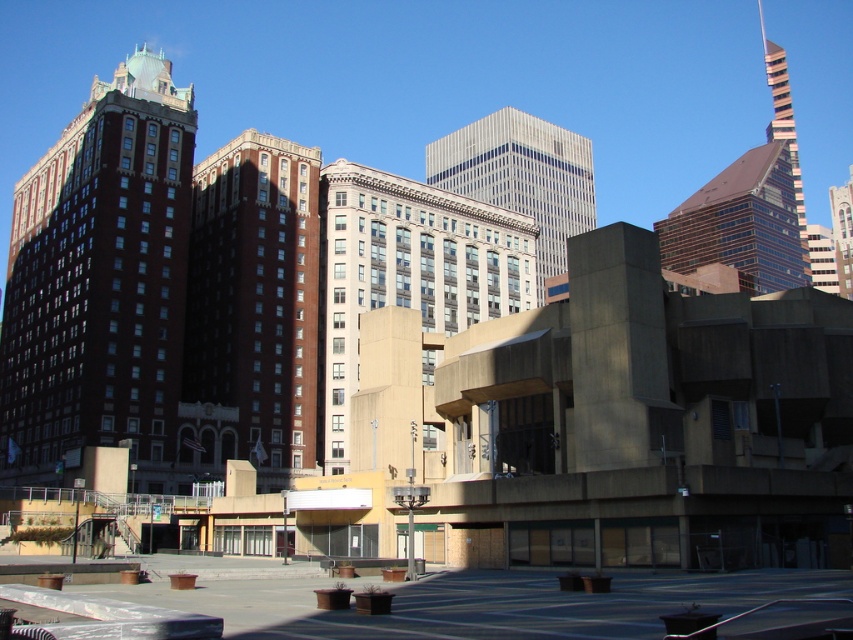
Question: Does brick building at left have a lesser width compared to white glass building at center?

Choices:
 (A) no
 (B) yes

Answer: (A)

Question: Does brown brick building at center appear on the right side of white glass building at center?

Choices:
 (A) yes
 (B) no

Answer: (B)

Question: Which object is farther from the camera taking this photo?

Choices:
 (A) white glass building at center
 (B) white glass skyscraper at center
 (C) brown brick building at center

Answer: (B)

Question: Which of the following is the farthest from the observer?

Choices:
 (A) (242, 276)
 (B) (784, 248)
 (C) (519, 308)

Answer: (B)

Question: Which point is closer to the camera taking this photo?

Choices:
 (A) (741, 177)
 (B) (115, 100)
 (C) (279, 477)

Answer: (C)

Question: Is brown brick building at center to the right of glassy reflective building at upper right from the viewer's perspective?

Choices:
 (A) yes
 (B) no

Answer: (B)